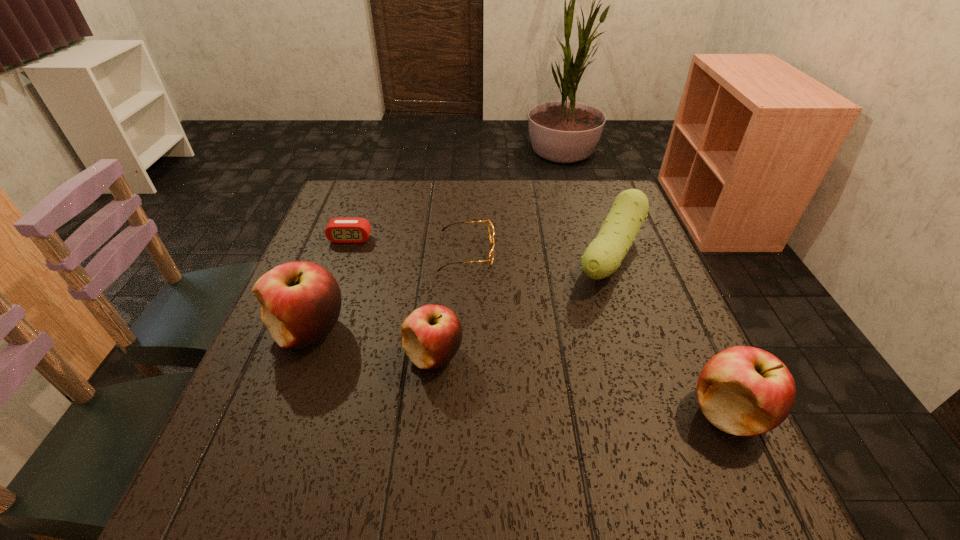
To achieve uniform spacing by inserting another apple among them, please point to a free space for this new apple. Please provide its 2D coordinates. Your answer should be formatted as a tuple, i.e. [(x, y)], where the tuple contains the x and y coordinates of a point satisfying the conditions above.

[(573, 382)]